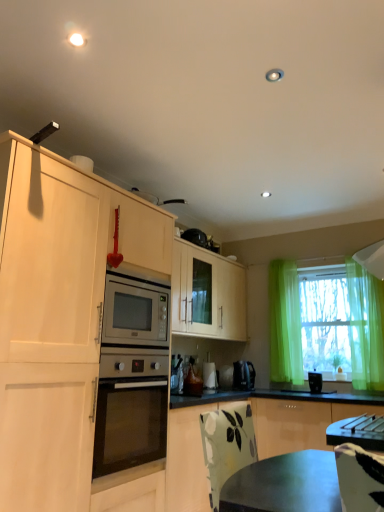
Question: Which direction should I rotate to face metallic silver toaster at center, positioned as the 2th appliance in front-to-back order, — up or down?

Choices:
 (A) up
 (B) down

Answer: (B)

Question: Is green sheer curtain at right not near white glossy coffee maker at lower center, which is counted as the second appliance, starting from the left?

Choices:
 (A) no
 (B) yes

Answer: (B)

Question: From a real-world perspective, is green sheer curtain at right physically below white glossy coffee maker at lower center, which is the first appliance in back-to-front order?

Choices:
 (A) yes
 (B) no

Answer: (B)

Question: Does green sheer curtain at right have a larger size compared to white glossy coffee maker at lower center, the third appliance in the front-to-back sequence?

Choices:
 (A) yes
 (B) no

Answer: (A)

Question: Is the position of green sheer curtain at right more distant than that of white glossy coffee maker at lower center, the third appliance in the front-to-back sequence?

Choices:
 (A) yes
 (B) no

Answer: (B)

Question: From the image's perspective, is green sheer curtain at right above white glossy coffee maker at lower center, which is counted as the second appliance, starting from the left?

Choices:
 (A) yes
 (B) no

Answer: (A)

Question: Is green sheer curtain at right oriented away from white glossy coffee maker at lower center, which is the first appliance in back-to-front order?

Choices:
 (A) no
 (B) yes

Answer: (A)

Question: Considering the relative positions of black plastic toaster at right, acting as the 1th appliance starting from the front, and translucent green curtain at right in the image provided, is black plastic toaster at right, acting as the 1th appliance starting from the front, to the left of translucent green curtain at right from the viewer's perspective?

Choices:
 (A) no
 (B) yes

Answer: (B)

Question: Can you confirm if black plastic toaster at right, the third appliance from the back, is wider than translucent green curtain at right?

Choices:
 (A) no
 (B) yes

Answer: (A)

Question: Considering the relative sizes of black plastic toaster at right, the third appliance from the back, and translucent green curtain at right in the image provided, is black plastic toaster at right, the third appliance from the back, bigger than translucent green curtain at right?

Choices:
 (A) yes
 (B) no

Answer: (B)

Question: Is black plastic toaster at right, the third appliance from the back, far from translucent green curtain at right?

Choices:
 (A) yes
 (B) no

Answer: (B)

Question: Is black plastic toaster at right, acting as the 1th appliance starting from the front, in contact with translucent green curtain at right?

Choices:
 (A) no
 (B) yes

Answer: (A)

Question: From the image's perspective, is black plastic toaster at right, marked as the third appliance in a left-to-right arrangement, located above translucent green curtain at right?

Choices:
 (A) yes
 (B) no

Answer: (B)

Question: Can you confirm if white glossy coffee maker at lower center, which is the 2th appliance from right to left, is wider than black plastic toaster at right, acting as the 1th appliance starting from the front?

Choices:
 (A) no
 (B) yes

Answer: (A)